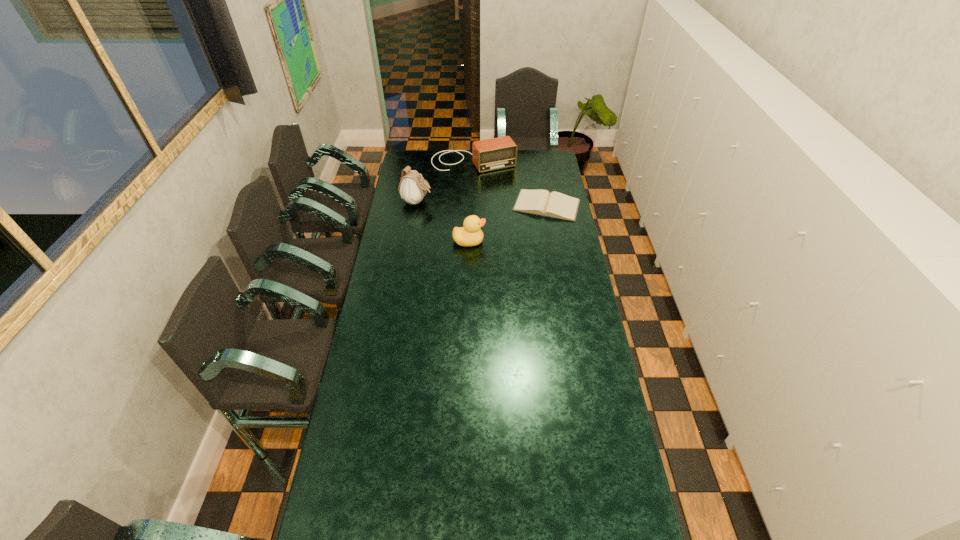
At what (x,y) coordinates should I click in order to perform the action: click on vacant space at the near left corner. Please return your answer as a coordinate pair (x, y). Image resolution: width=960 pixels, height=540 pixels. Looking at the image, I should click on (331, 524).

The width and height of the screenshot is (960, 540). Identify the location of free space at the near right corner of the desktop. point(628,499).

The height and width of the screenshot is (540, 960). In order to click on vacant area that lies between the tallest object and the farthest object in this screenshot , I will do `click(445, 181)`.

Find the location of a particular element. The height and width of the screenshot is (540, 960). free space between the radio receiver and the shortest object is located at coordinates (510, 184).

Image resolution: width=960 pixels, height=540 pixels. Find the location of `vacant area that lies between the Bible and the radio receiver`. vacant area that lies between the Bible and the radio receiver is located at coordinates (510, 184).

Locate an element on the screen. This screenshot has width=960, height=540. vacant area between the duck and the shortest object is located at coordinates (508, 223).

Find the location of `free space between the farthest object and the duck`. free space between the farthest object and the duck is located at coordinates (471, 201).

Identify the location of vacant area that lies between the pouch and the shortest object. (482, 203).

Identify the location of vacant region between the nearest object and the shortest object. (508, 223).

Locate an element on the screen. The height and width of the screenshot is (540, 960). vacant area that lies between the tallest object and the Bible is located at coordinates (482, 203).